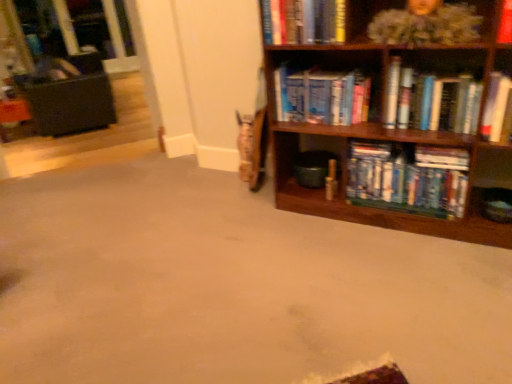
Question: Is hardcover book at right, the second book ordered from the bottom, not within wooden bookcase at right?

Choices:
 (A) yes
 (B) no

Answer: (B)

Question: Is hardcover book at right, the second book ordered from the bottom, smaller than wooden bookcase at right?

Choices:
 (A) yes
 (B) no

Answer: (A)

Question: Can you confirm if hardcover book at right, the 4th book when ordered from top to bottom, is bigger than wooden bookcase at right?

Choices:
 (A) no
 (B) yes

Answer: (A)

Question: From a real-world perspective, does hardcover book at right, the second book ordered from the bottom, stand above wooden bookcase at right?

Choices:
 (A) yes
 (B) no

Answer: (A)

Question: Is hardcover book at right, the second book ordered from the bottom, looking in the opposite direction of wooden bookcase at right?

Choices:
 (A) no
 (B) yes

Answer: (B)

Question: Does hardcover book at right, the 4th book when ordered from top to bottom, appear on the left side of wooden bookcase at right?

Choices:
 (A) no
 (B) yes

Answer: (A)

Question: Does hardcover books at center, which is the 1th book in bottom-to-top order, have a greater width compared to hardcover book at upper right, the third book from the top?

Choices:
 (A) yes
 (B) no

Answer: (A)

Question: Does hardcover books at center, placed as the 5th book when sorted from top to bottom, lie behind hardcover book at upper right, the third book ordered from the bottom?

Choices:
 (A) no
 (B) yes

Answer: (B)

Question: Considering the relative sizes of hardcover books at center, placed as the 5th book when sorted from top to bottom, and hardcover book at upper right, the third book ordered from the bottom, in the image provided, is hardcover books at center, placed as the 5th book when sorted from top to bottom, shorter than hardcover book at upper right, the third book ordered from the bottom,?

Choices:
 (A) yes
 (B) no

Answer: (A)

Question: Is hardcover books at center, placed as the 5th book when sorted from top to bottom, smaller than hardcover book at upper right, the third book from the top?

Choices:
 (A) no
 (B) yes

Answer: (A)

Question: Is hardcover book at upper right, the third book from the top, at the back of hardcover books at center, which is the 1th book in bottom-to-top order?

Choices:
 (A) no
 (B) yes

Answer: (A)

Question: From a real-world perspective, is hardcover books at center, which is the 1th book in bottom-to-top order, located higher than hardcover book at upper right, the third book ordered from the bottom?

Choices:
 (A) yes
 (B) no

Answer: (B)

Question: Does hardcover book at right, the second book ordered from the bottom, come behind hardcover books at center, which is the 1th book in bottom-to-top order?

Choices:
 (A) no
 (B) yes

Answer: (A)